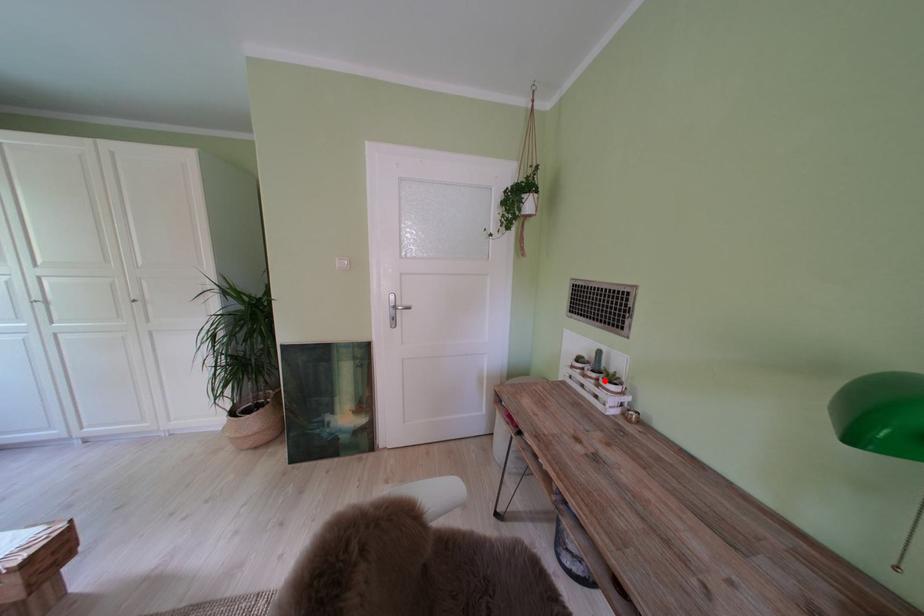
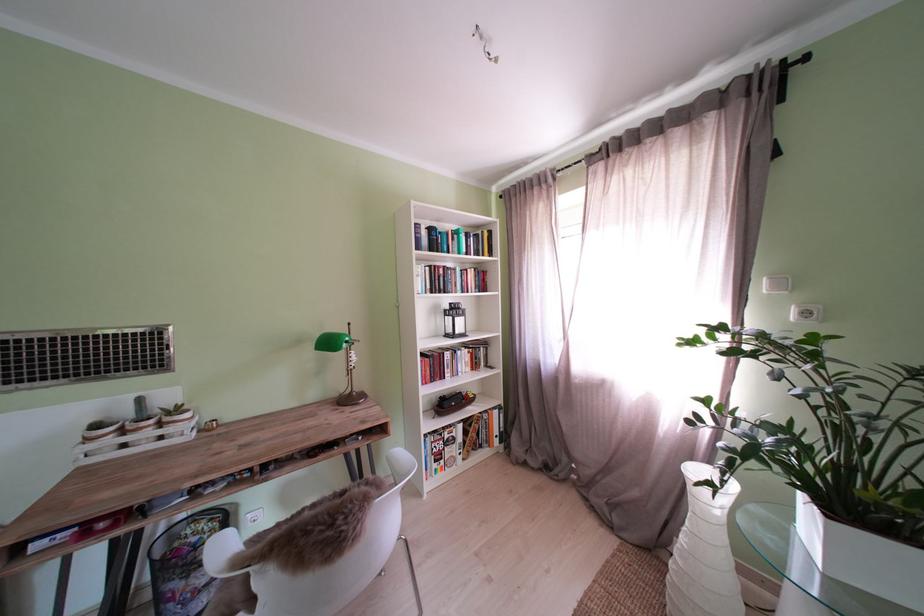
In the second image, find the point that corresponds to the highlighted location in the first image.

(163, 427)